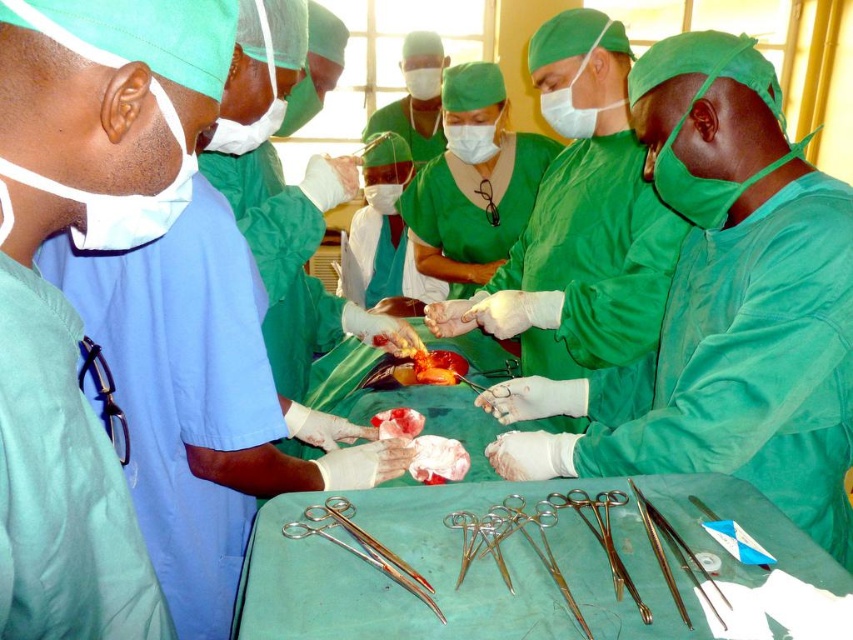
Can you confirm if surgical scissors at lower center is smaller than satin silver forceps at lower right?

Incorrect, surgical scissors at lower center is not smaller in size than satin silver forceps at lower right.

This screenshot has height=640, width=853. I want to click on surgical scissors at lower center, so click(x=361, y=545).

Is green matte surgical gown at center in front of satin silver forceps at lower right?

No.

Is point (601, 472) closer to camera compared to point (677, 611)?

No.

You are a GUI agent. You are given a task and a screenshot of the screen. Output one action in this format:
    pyautogui.click(x=<x>, y=<y>)
    Task: Click on the green matte surgical gown at center
    
    Given the screenshot: What is the action you would take?
    pyautogui.click(x=721, y=307)

Between green matte surgical gown at center and surgical scissors at lower center, which one has less height?

surgical scissors at lower center

Between point (776, 323) and point (373, 554), which one is positioned in front?

Positioned in front is point (373, 554).

The image size is (853, 640). Identify the location of green matte surgical gown at center. (721, 307).